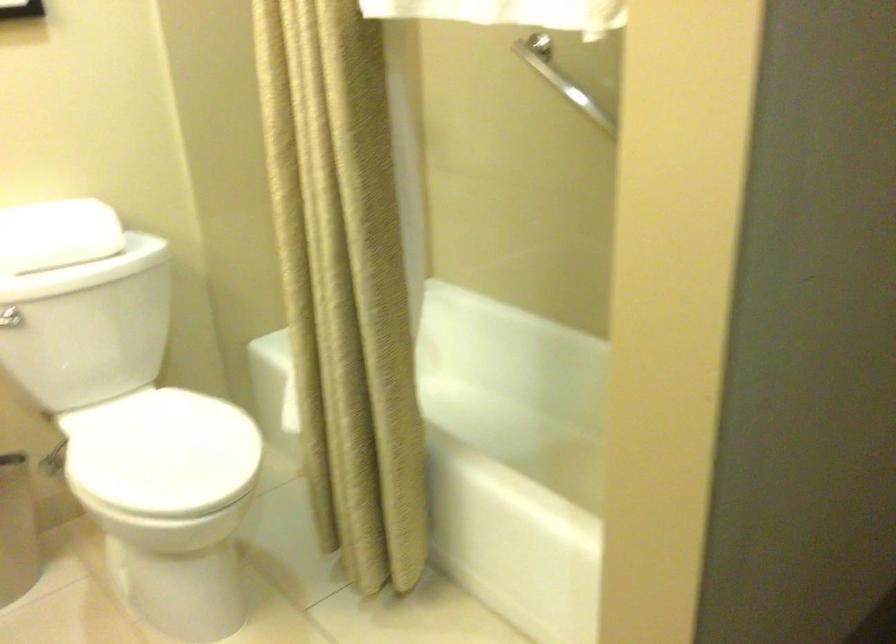
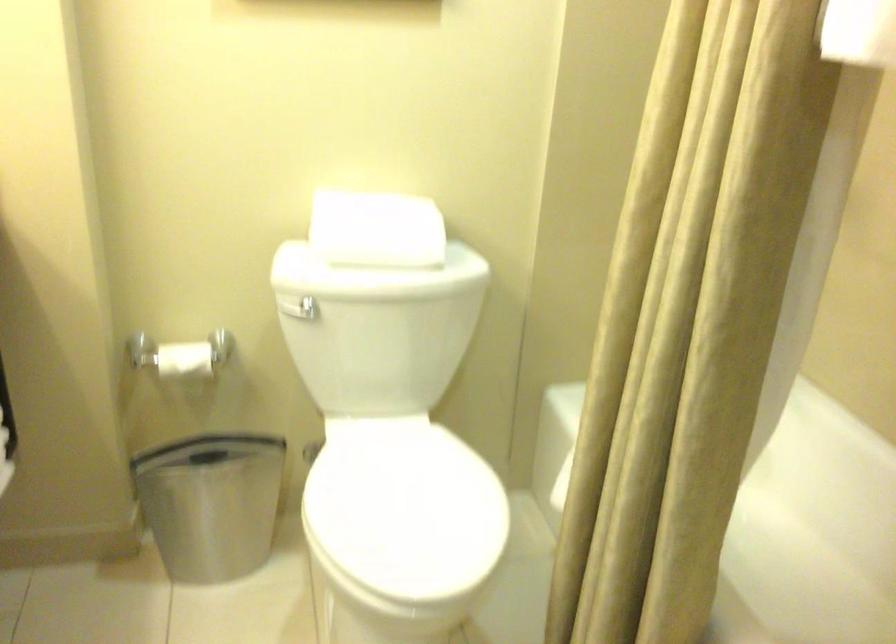
Question: The camera is either moving clockwise (left) or counter-clockwise (right) around the object. The first image is from the beginning of the video and the second image is from the end. Is the camera moving left or right when shooting the video?

Choices:
 (A) Left
 (B) Right

Answer: (B)